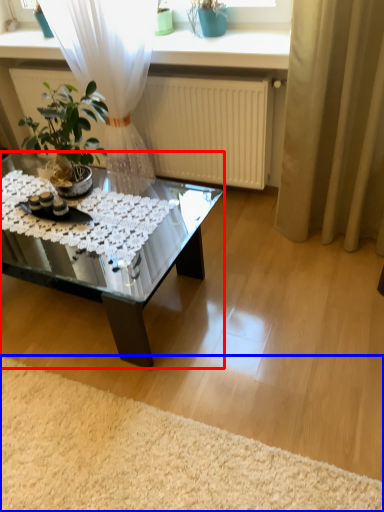
Question: Which object is closer to the camera taking this photo, coffee table (highlighted by a red box) or plain (highlighted by a blue box)?

Choices:
 (A) coffee table
 (B) plain

Answer: (B)